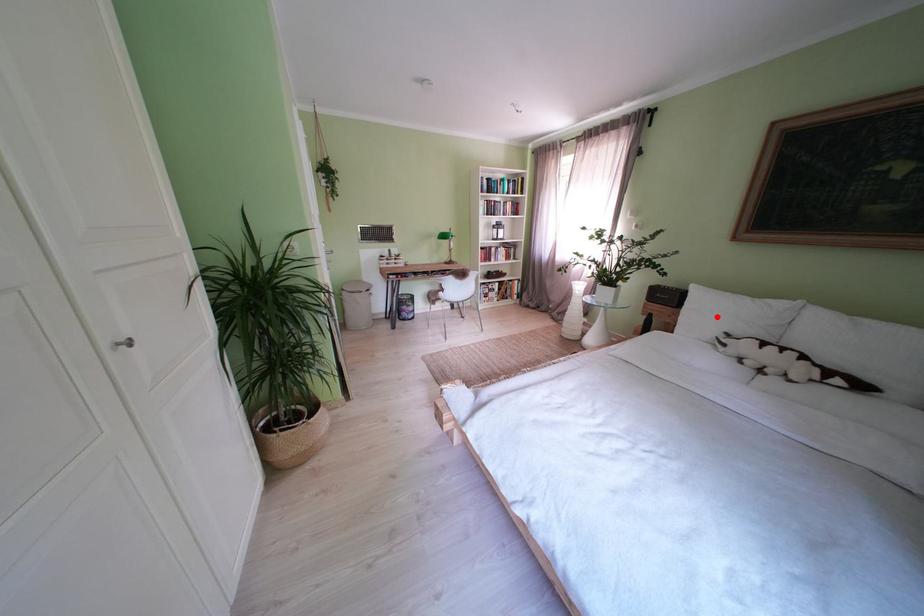
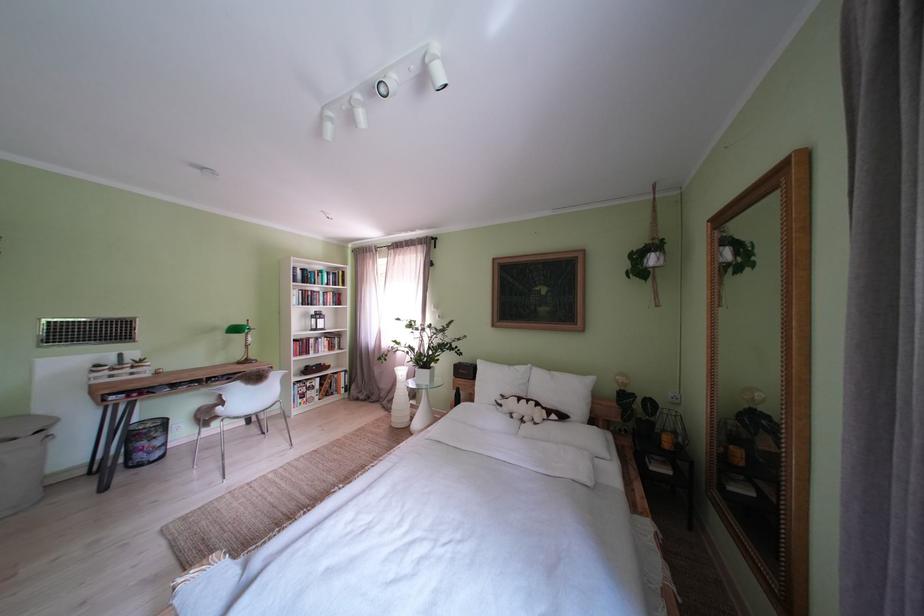
Question: I am providing you with two images of the same scene from different viewpoints. A red point is marked on the first image. Is the red point's position out of view in image 2?

Choices:
 (A) Yes
 (B) No

Answer: (B)